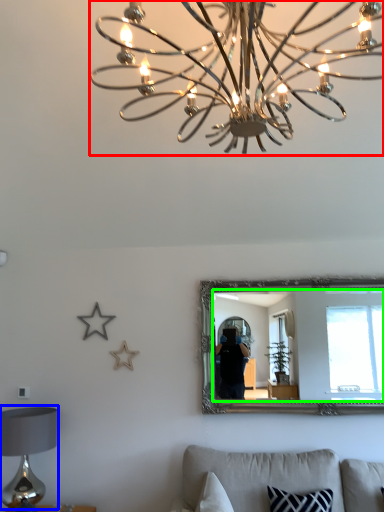
Question: Based on their relative distances, which object is nearer to lamp (highlighted by a red box)? Choose from table lamp (highlighted by a blue box) and mirror (highlighted by a green box).

Choices:
 (A) table lamp
 (B) mirror

Answer: (A)